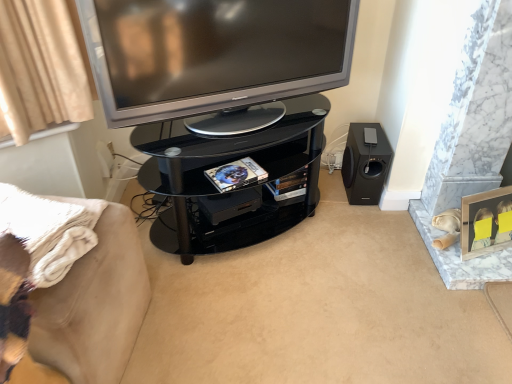
Locate an element on the screen. free space in front of black glass tv cabinet at center is located at coordinates (266, 309).